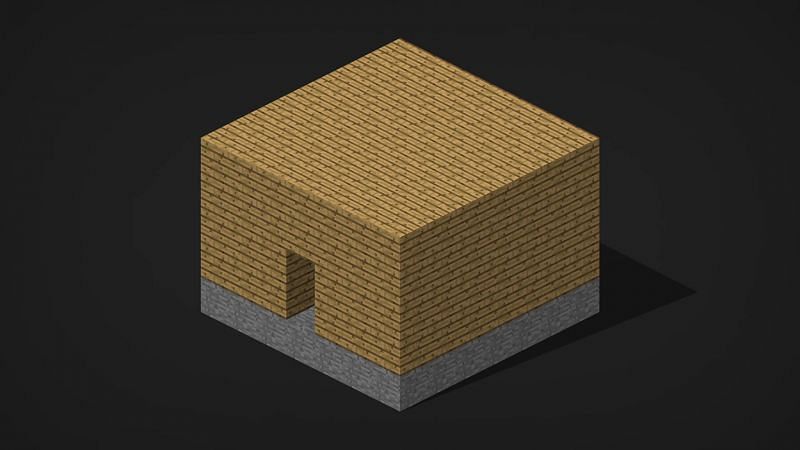
Locate an element on the screen. The width and height of the screenshot is (800, 450). doorway is located at coordinates (306, 287).